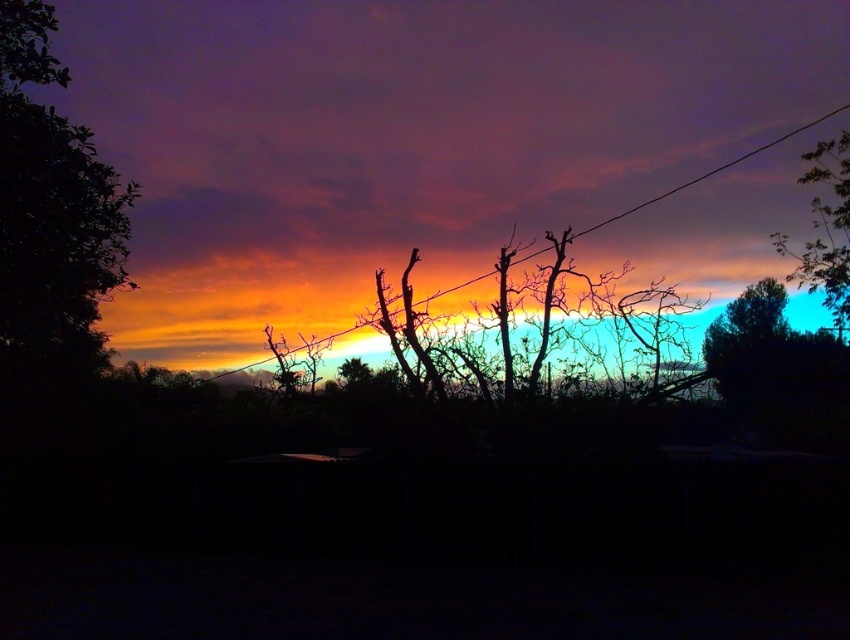
Question: Which object appears farthest from the camera in this image?

Choices:
 (A) green leafy tree at left
 (B) orange matte power line at center
 (C) green leafy tree at upper right
 (D) silhouette bare branches at center

Answer: (B)

Question: Considering the relative positions of silhouette bare branches at center and green leafy tree at upper right in the image provided, where is silhouette bare branches at center located with respect to green leafy tree at upper right?

Choices:
 (A) below
 (B) above

Answer: (A)

Question: Can you confirm if silhouette bare branches at center is thinner than orange matte power line at center?

Choices:
 (A) yes
 (B) no

Answer: (A)

Question: Among these objects, which one is farthest from the camera?

Choices:
 (A) green leafy tree at left
 (B) silhouette bare branches at center
 (C) green leafy tree at upper right

Answer: (C)

Question: Is green leafy tree at left thinner than orange matte power line at center?

Choices:
 (A) no
 (B) yes

Answer: (B)

Question: Which object appears closest to the camera in this image?

Choices:
 (A) green leafy tree at upper right
 (B) silhouette bare branches at center

Answer: (B)